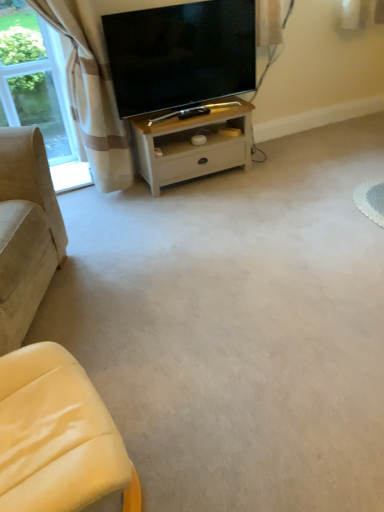
This screenshot has height=512, width=384. In order to click on vacant area that lies between beige plaid curtain at upper left and yellow leather studio couch at lower left, which is the 1th studio couch from right to left in this screenshot , I will do `click(105, 282)`.